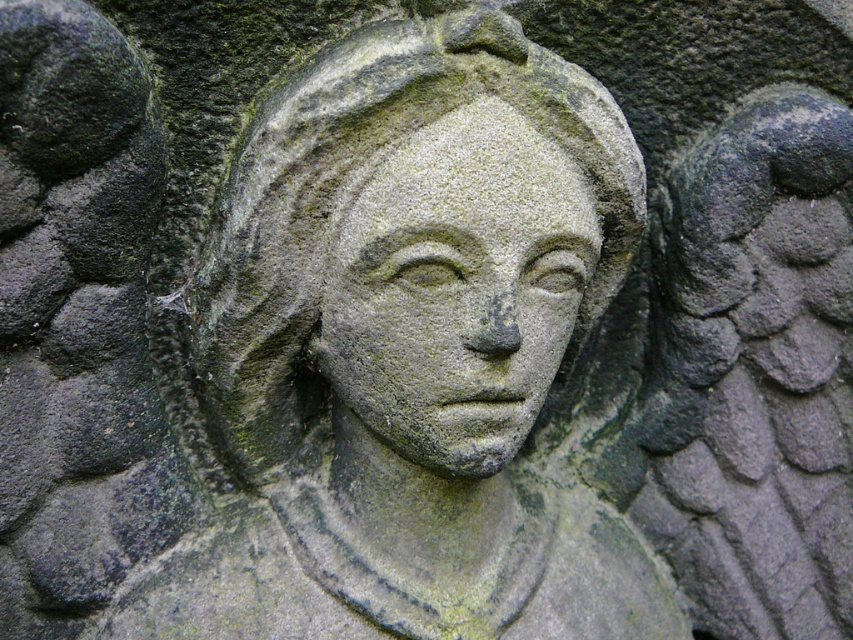
You are an art conservator examining the green stone carving at center and the green stone face at center. Which object would require more material to repair due to its size?

The green stone carving at center requires more material to repair because it has a larger size compared to the green stone face at center.

Looking at this image, you are an archaeologist examining the stone carving. You notice two points on the sculpture labeled as point 1 at coordinates point (335, 216) and point 2 at coordinates point (428, 320). Which point is closer to the camera?

Point (335, 216) is further to the camera than point (428, 320). Wait, the question asks which is closer. So the answer is point (428, 320) is closer to the camera than point (335, 216).

You are an archaeologist examining a stone carving. You notice a point at coordinates (409, 352). What does this point represent?

The point at coordinates (409, 352) represents the green stone carving at center.